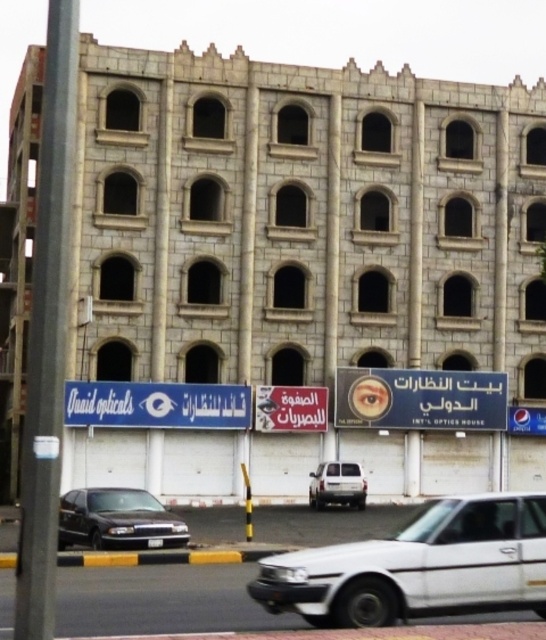
Question: Which of the following is the closest to the observer?

Choices:
 (A) (478, 397)
 (B) (151, 500)
 (C) (416, 529)
 (D) (317, 508)

Answer: (C)

Question: Is white matte car at lower right behind blue plastic signboard at center?

Choices:
 (A) yes
 (B) no

Answer: (B)

Question: Is white matte car at lower right wider than shiny black sedan at lower left?

Choices:
 (A) yes
 (B) no

Answer: (A)

Question: Does blue plastic signboard at center appear on the right side of white matte van at center?

Choices:
 (A) no
 (B) yes

Answer: (B)

Question: Among these points, which one is farthest from the camera?

Choices:
 (A) (413, 417)
 (B) (397, 563)

Answer: (A)

Question: Which of the following is the farthest from the observer?

Choices:
 (A) (543, 609)
 (B) (97, 490)

Answer: (B)